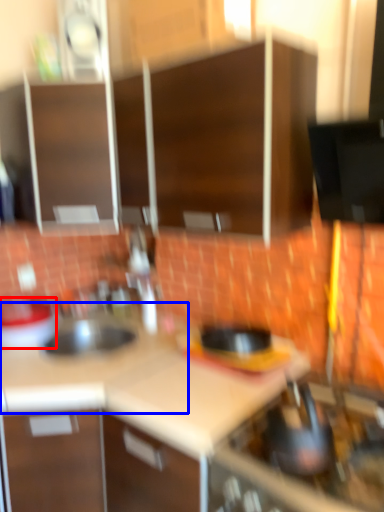
Question: Which point is closer to the camera, kitchen appliance (highlighted by a red box) or counter top (highlighted by a blue box)?

Choices:
 (A) kitchen appliance
 (B) counter top

Answer: (B)